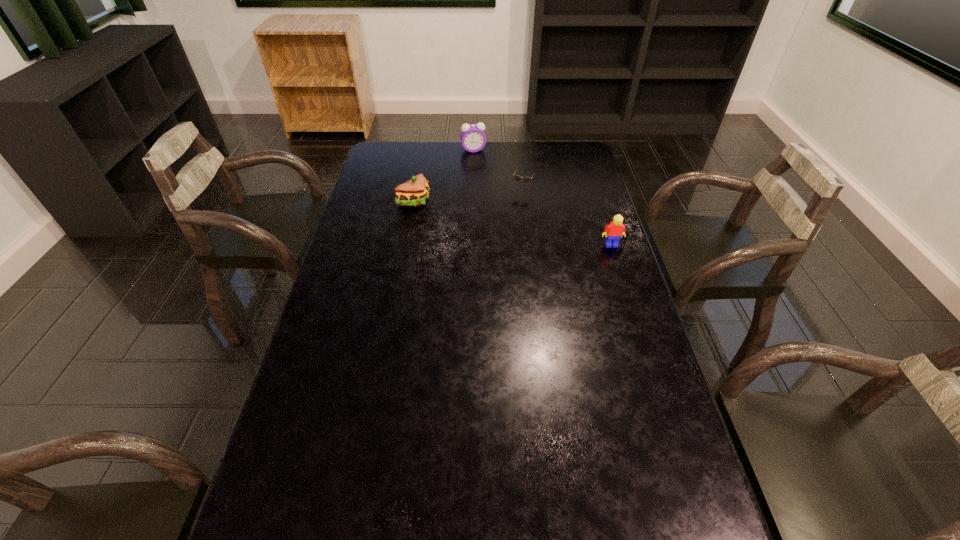
This screenshot has width=960, height=540. What are the coordinates of `free space on the desktop that is between the leftmost object and the Lego and is positioned on the face of the alarm clock` in the screenshot? It's located at (492, 218).

The image size is (960, 540). In order to click on vacant spot on the desktop that is between the leftmost object and the Lego and is positioned in front of the lenses of the shortest object in this screenshot , I will do `click(504, 221)`.